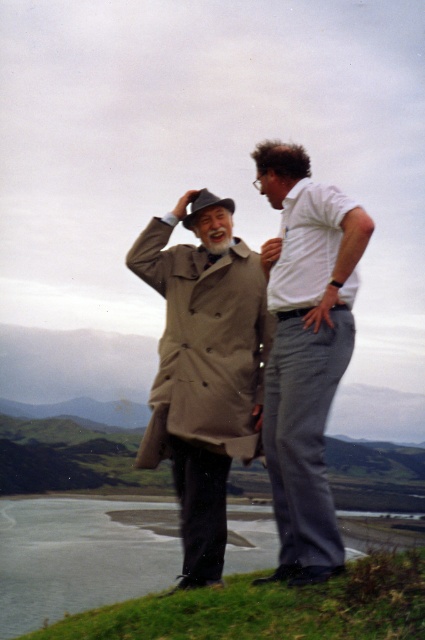
Is white cotton shirt at center below beige fabric trench coat at center?

Indeed, white cotton shirt at center is positioned under beige fabric trench coat at center.

Who is more forward, (308, 561) or (164, 390)?

Point (308, 561)

Is point (328, 406) closer to camera compared to point (257, 280)?

Yes, point (328, 406) is in front of point (257, 280).

At what (x,y) coordinates should I click in order to perform the action: click on white cotton shirt at center. Please return your answer as a coordinate pair (x, y). Image resolution: width=425 pixels, height=640 pixels. Looking at the image, I should click on (306, 352).

Can you confirm if beige wool coat at center is wider than beige fabric trench coat at center?

In fact, beige wool coat at center might be narrower than beige fabric trench coat at center.

Who is taller, beige wool coat at center or beige fabric trench coat at center?

With more height is beige fabric trench coat at center.

Does point (277, 470) come in front of point (234, 316)?

Yes, point (277, 470) is closer to viewer.

I want to click on beige wool coat at center, so click(306, 352).

Which is more to the right, beige wool coat at center or white cotton shirt at center?

Positioned to the right is white cotton shirt at center.

Is point (291, 497) positioned before point (294, 349)?

That is True.

The height and width of the screenshot is (640, 425). Find the location of `beige wool coat at center`. beige wool coat at center is located at coordinates (306, 352).